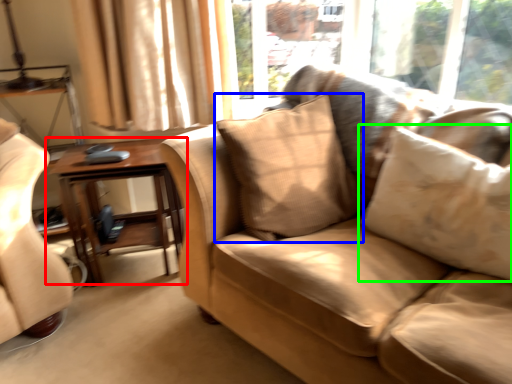
Question: Considering the real-world distances, which object is closest to table (highlighted by a red box)? pillow (highlighted by a blue box) or pillow (highlighted by a green box).

Choices:
 (A) pillow
 (B) pillow

Answer: (A)